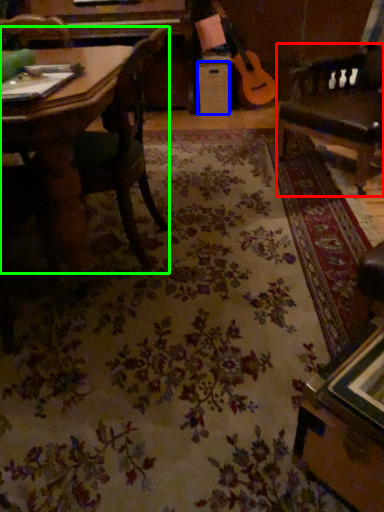
Question: Estimate the real-world distances between objects in this image. Which object is farther from swivel chair (highlighted by a red box), drawer (highlighted by a blue box) or chair (highlighted by a green box)?

Choices:
 (A) drawer
 (B) chair

Answer: (A)